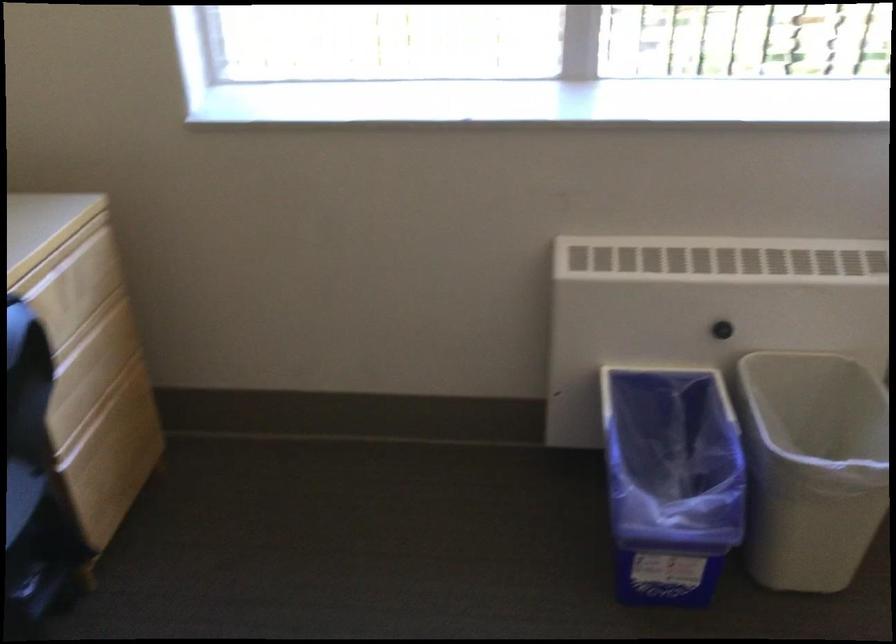
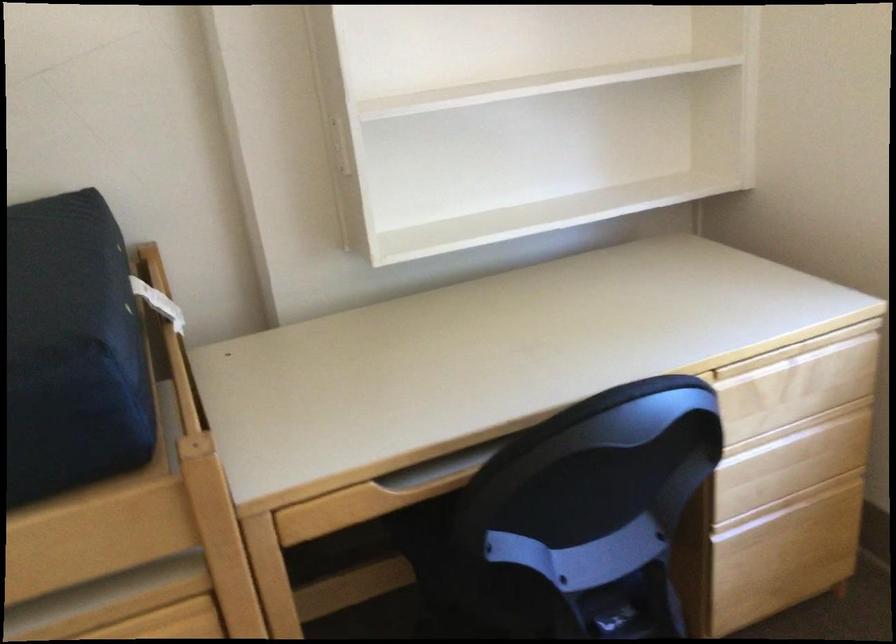
Where in the second image is the point corresponding to (x=91, y=351) from the first image?

(791, 440)